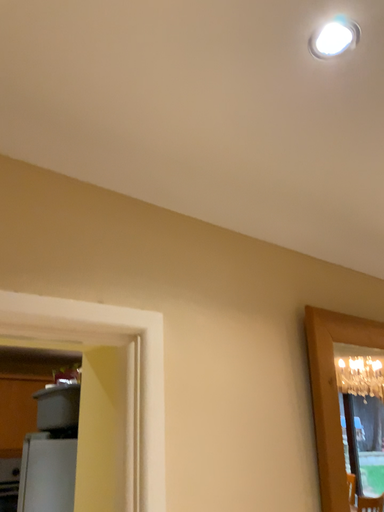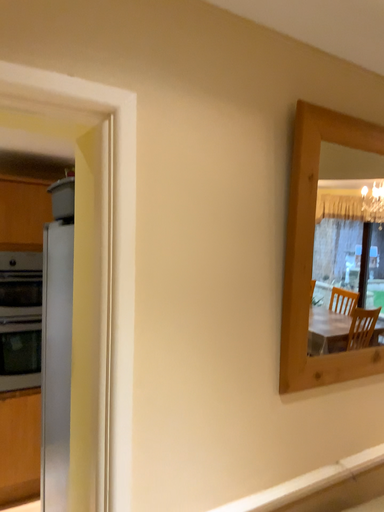
Question: How did the camera likely rotate when shooting the video?

Choices:
 (A) rotated downward
 (B) rotated upward

Answer: (A)